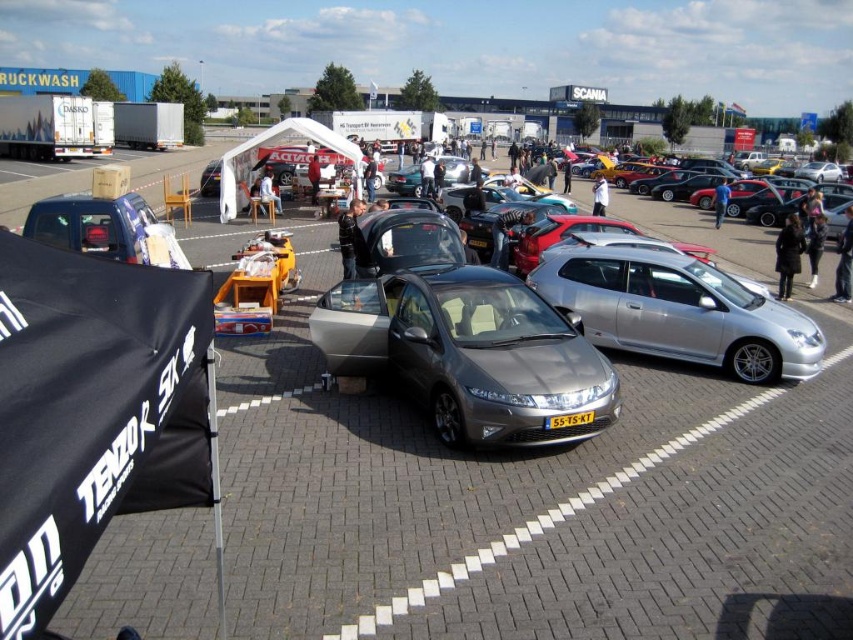
Is dark gray fabric jacket at center to the left of matte black car at center from the viewer's perspective?

Correct, you'll find dark gray fabric jacket at center to the left of matte black car at center.

Between dark gray fabric jacket at center and matte black car at center, which one has less height?

With less height is matte black car at center.

At what (x,y) coordinates should I click in order to perform the action: click on dark gray fabric jacket at center. Please return your answer as a coordinate pair (x, y). Image resolution: width=853 pixels, height=640 pixels. Looking at the image, I should click on (427, 177).

Between black leather jacket at center and black leather jacket at lower right, which one is positioned lower?

black leather jacket at lower right is below.

Is black leather jacket at center below black leather jacket at lower right?

Incorrect, black leather jacket at center is not positioned below black leather jacket at lower right.

Between point (791, 276) and point (813, 234), which one is positioned behind?

Positioned behind is point (813, 234).

The height and width of the screenshot is (640, 853). Find the location of `black leather jacket at center`. black leather jacket at center is located at coordinates (788, 253).

Consider the image. Which is below, dark gray jacket at center or matte black car at center?

dark gray jacket at center

Is dark gray jacket at center in front of matte black car at center?

Yes.

The width and height of the screenshot is (853, 640). I want to click on dark gray jacket at center, so click(349, 237).